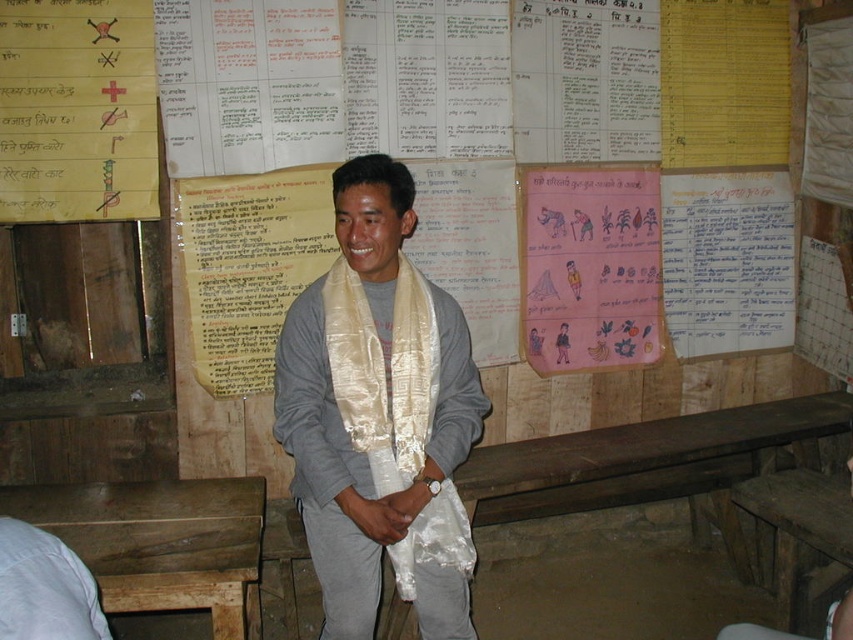
You are taking a photo of the man in the classroom. Which point, point [581,204] or point [711,340], will appear larger in the photo?

Point [581,204] is closer to the camera than point [711,340], so it will appear larger in the photo.

From the picture: You are organizing a cultural event and need to decide which poster to feature prominently. Given the pink paper poster at center and the blue paper at upper right, which one would you choose based on their sizes?

The pink paper poster at center is bigger than the blue paper at upper right, so it would be the better choice for prominent display due to its larger size.

You are an observer in the classroom. You notice two items in the image, the silky beige scarf at center and the light gray fabric at lower left. Which item is taller?

The silky beige scarf at center is taller than the light gray fabric at lower left.